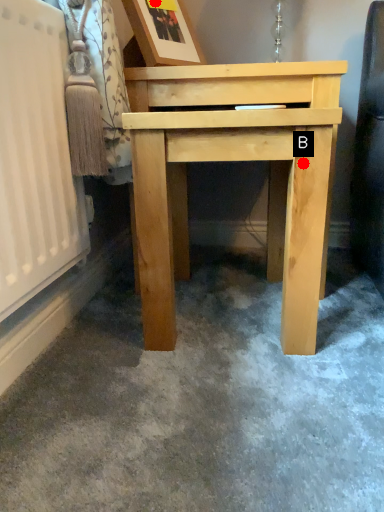
Question: Two points are circled on the image, labeled by A and B beside each circle. Among these points, which one is nearest to the camera?

Choices:
 (A) A is closer
 (B) B is closer

Answer: (B)